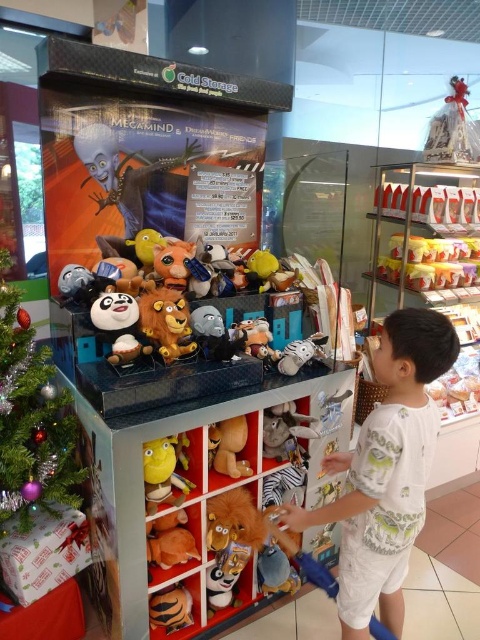
You are a customer in the store and want to place the green shiny christmas tree at lower left on top of the white cotton shirt at center. Is this possible based on their sizes?

The white cotton shirt at center has a greater height compared to the green shiny christmas tree at lower left. Therefore, placing the green shiny christmas tree at lower left on top of the white cotton shirt at center would be possible since the shirt is taller.

You are a child trying to grab a toy from the claw machine. You see the yellow plush toy at center and the brown plush toy at center. Which one is positioned higher?

The yellow plush toy at center is located above the brown plush toy at center, so it is positioned higher.

You are a customer standing in front of the claw machine. You notice the green shiny christmas tree at lower left and the brown plush toy at center. Which object would you see first when looking at the claw machine?

The green shiny christmas tree at lower left is in front of the brown plush toy at center, so you would see the green shiny christmas tree at lower left first.